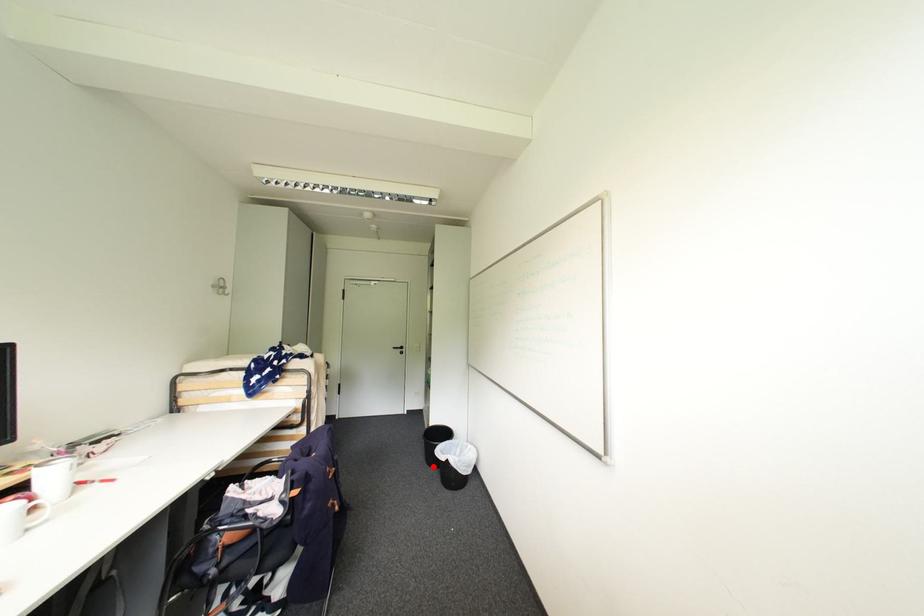
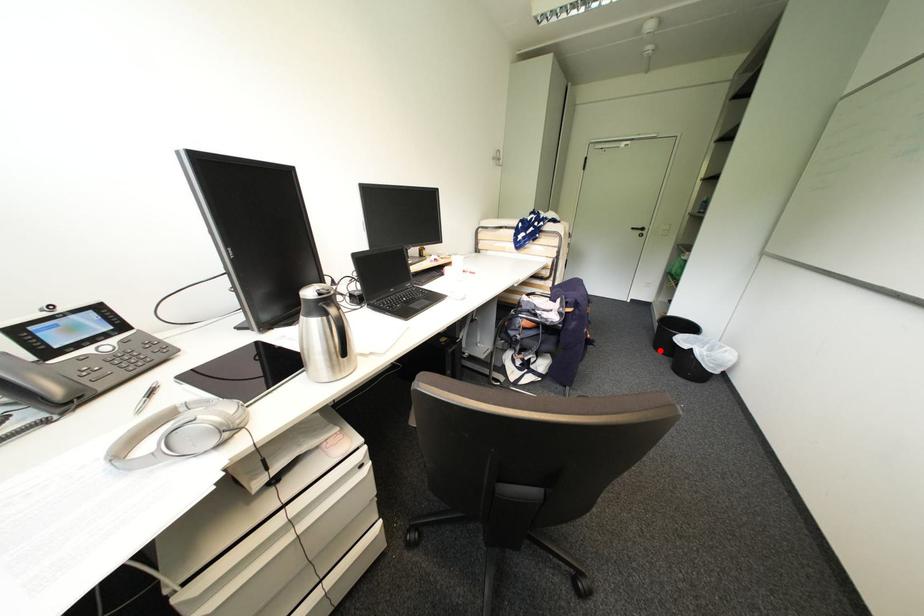
I am providing you with two images of the same scene from different viewpoints. A red point is marked on the first image and another point is marked on the second image. Is the red point in image1 aligned with the point shown in image2?

Yes